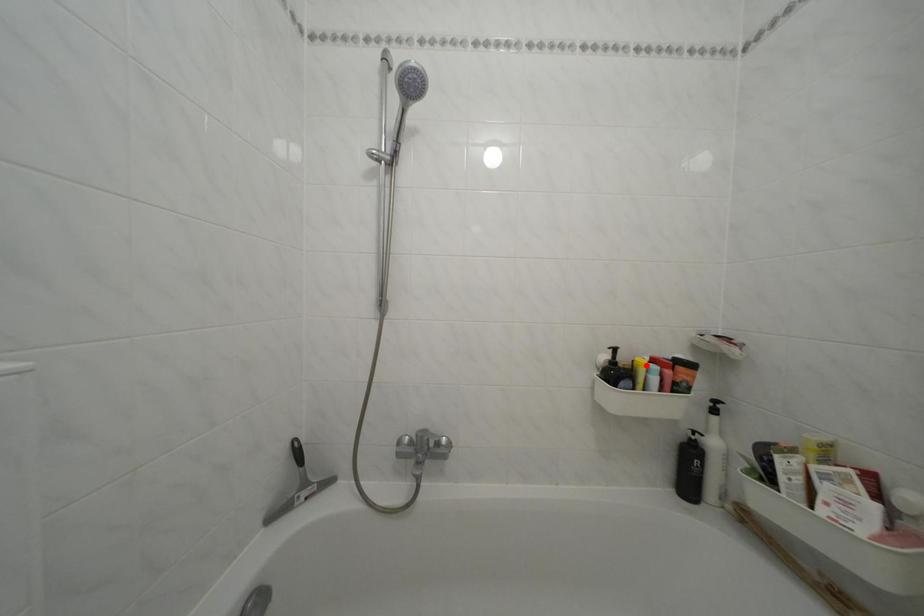
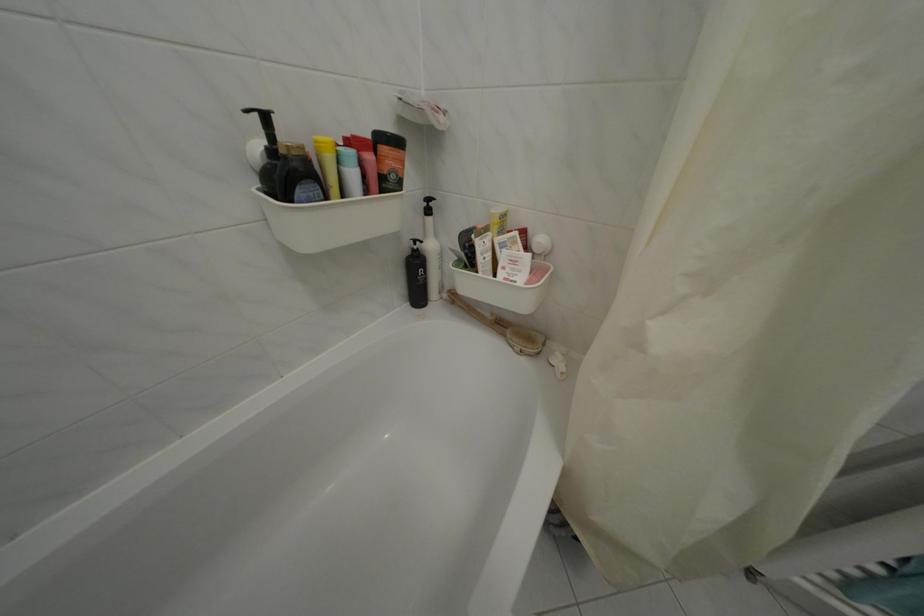
In the second image, find the point that corresponds to the highlighted location in the first image.

(325, 144)